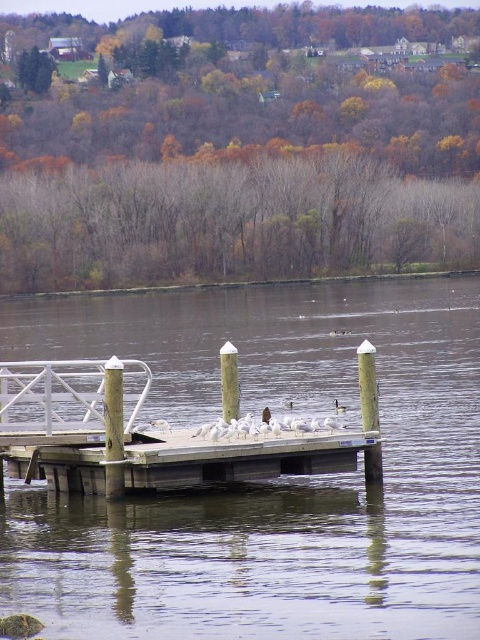
You are standing at the point marked as point (242, 458). Which object is exactly at your current location?

The wooden dock at center is located at point (242, 458), so the object exactly at your current location is the wooden dock at center.

You are standing on the wooden dock at center and want to reach the brown matte duck at center. Which direction should you move to get closer to the duck?

You should move to the right side since the wooden dock at center is positioned on the left side of the brown matte duck at center, meaning the duck is to your right.